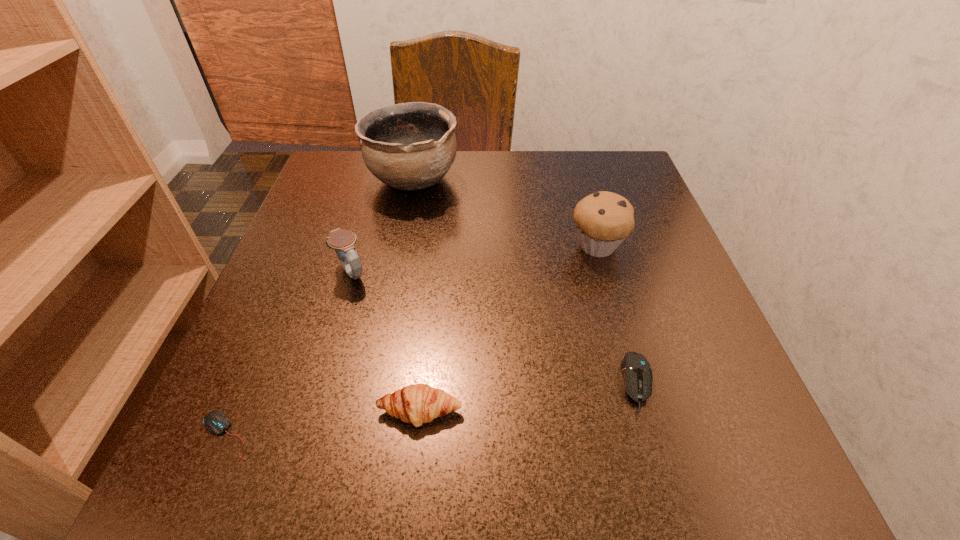
At what (x,y) coordinates should I click in order to perform the action: click on vacant area located on the left of the muffin. Please return your answer as a coordinate pair (x, y). The width and height of the screenshot is (960, 540). Looking at the image, I should click on (438, 246).

The image size is (960, 540). I want to click on free spot located 0.100m on the back of the watch, so click(366, 224).

Locate an element on the screen. vacant space situated 0.070m on the front-facing side of the fourth tallest object is located at coordinates (413, 486).

Locate an element on the screen. free location located on the back of the fifth tallest object is located at coordinates (603, 264).

Locate an element on the screen. The image size is (960, 540). vacant area located 0.160m on the right of the shortest object is located at coordinates (377, 435).

Locate an element on the screen. This screenshot has width=960, height=540. object located in the far edge section of the desktop is located at coordinates (411, 146).

Find the location of a particular element. This screenshot has height=540, width=960. pastry present at the near edge is located at coordinates (418, 403).

The image size is (960, 540). In order to click on mouse at the near edge in this screenshot , I will do `click(216, 422)`.

You are a GUI agent. You are given a task and a screenshot of the screen. Output one action in this format:
    pyautogui.click(x=<x>, y=<y>)
    Task: Click on the pottery located in the left edge section of the desktop
    
    Given the screenshot: What is the action you would take?
    pyautogui.click(x=411, y=146)

Identify the location of watch located in the left edge section of the desktop. (342, 241).